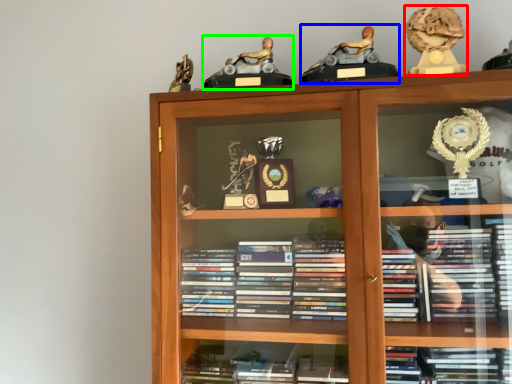
Question: Based on their relative distances, which object is farther from toy (highlighted by a red box)? Choose from toy (highlighted by a blue box) and toy (highlighted by a green box).

Choices:
 (A) toy
 (B) toy

Answer: (B)